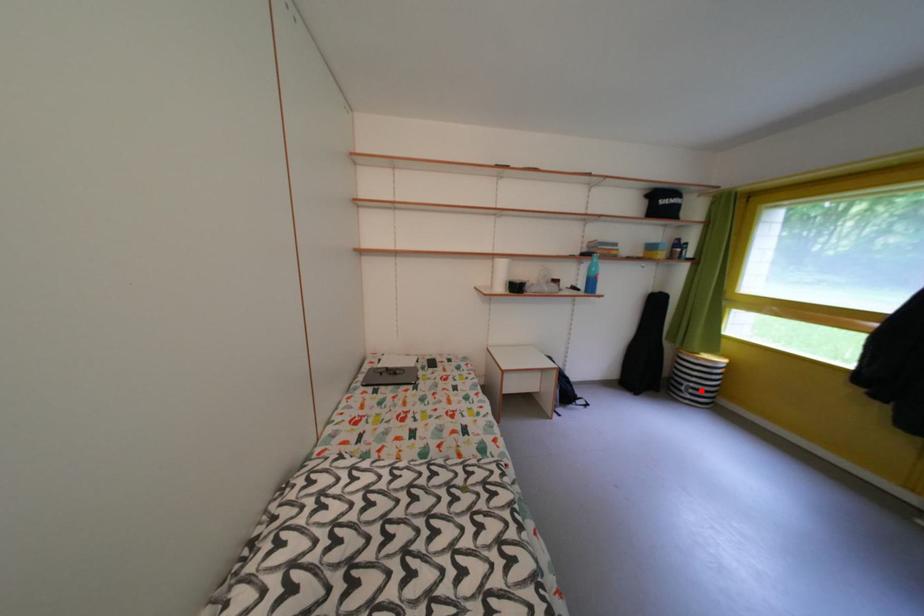
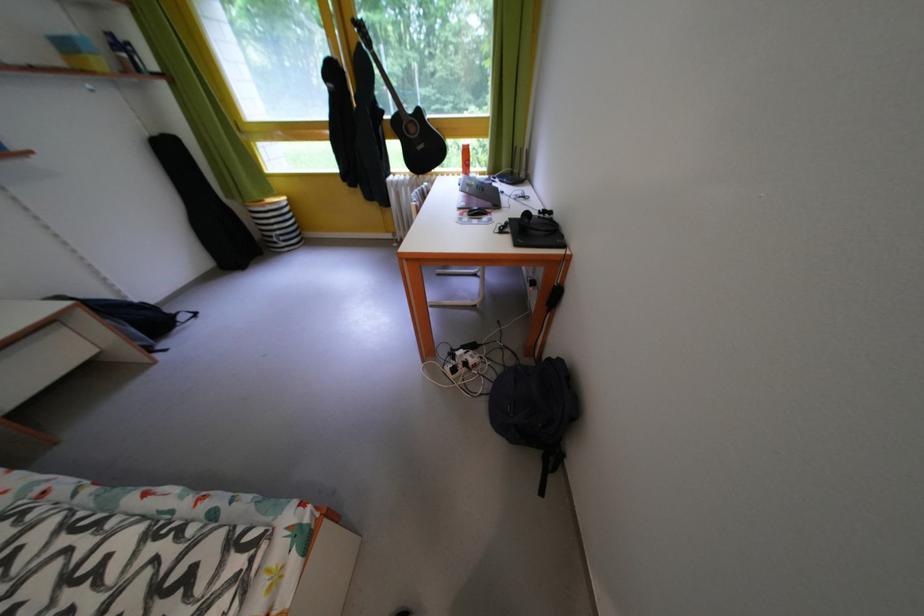
Question: I am providing you with two images of the same scene from different viewpoints. Given a red point in image1, look at the same physical point in image2. Is it:

Choices:
 (A) Closer to the viewpoint
 (B) Farther from the viewpoint

Answer: (B)